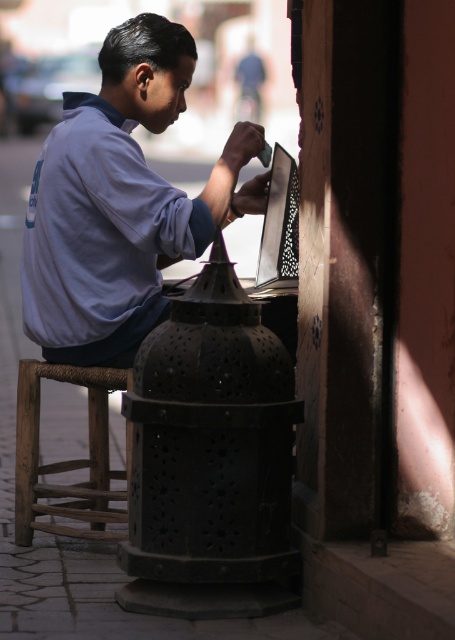
Between black metal lantern at center and matte blue shirt at center, which one has less height?

Standing shorter between the two is black metal lantern at center.

Is point (190, 608) positioned in front of point (148, 204)?

That is True.

Who is more distant from viewer, (203, 490) or (138, 248)?

Point (138, 248)

The height and width of the screenshot is (640, 455). What are the coordinates of `black metal lantern at center` in the screenshot? It's located at point(211,458).

Is matte blue shirt at center to the left of matte black laptop at center from the viewer's perspective?

Incorrect, matte blue shirt at center is not on the left side of matte black laptop at center.

Is matte blue shirt at center taller than matte black laptop at center?

Correct, matte blue shirt at center is much taller as matte black laptop at center.

Find the location of a particular element. matte blue shirt at center is located at coordinates (121, 202).

This screenshot has width=455, height=640. I want to click on matte blue shirt at center, so click(x=121, y=202).

Looking at this image, is black metal lantern at center above brown wooden stool at lower left?

Indeed, black metal lantern at center is positioned over brown wooden stool at lower left.

Find the location of a particular element. black metal lantern at center is located at coordinates (211, 458).